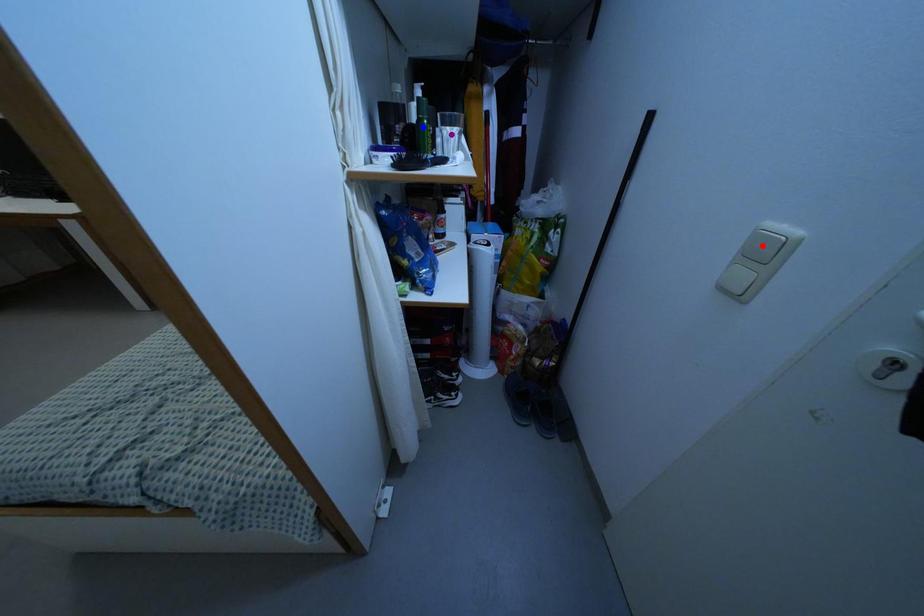
Order these from farthest to nearest:
A) blue point
B) purple point
C) red point

blue point, purple point, red point